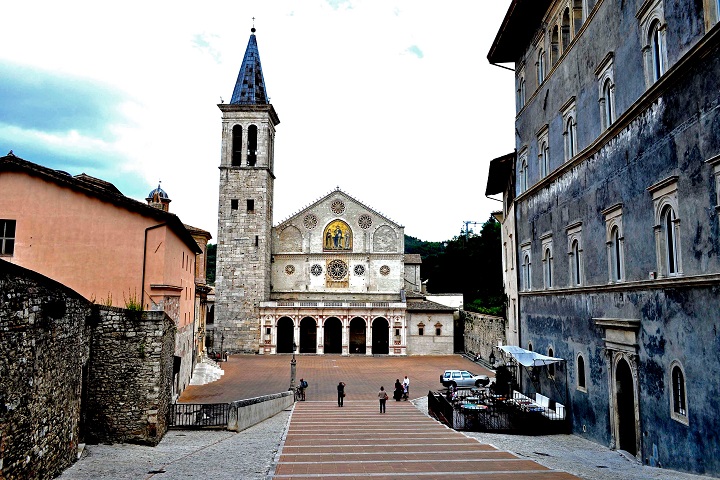
Identify the location of 1 brick wall. Image resolution: width=720 pixels, height=480 pixels. (126, 384).